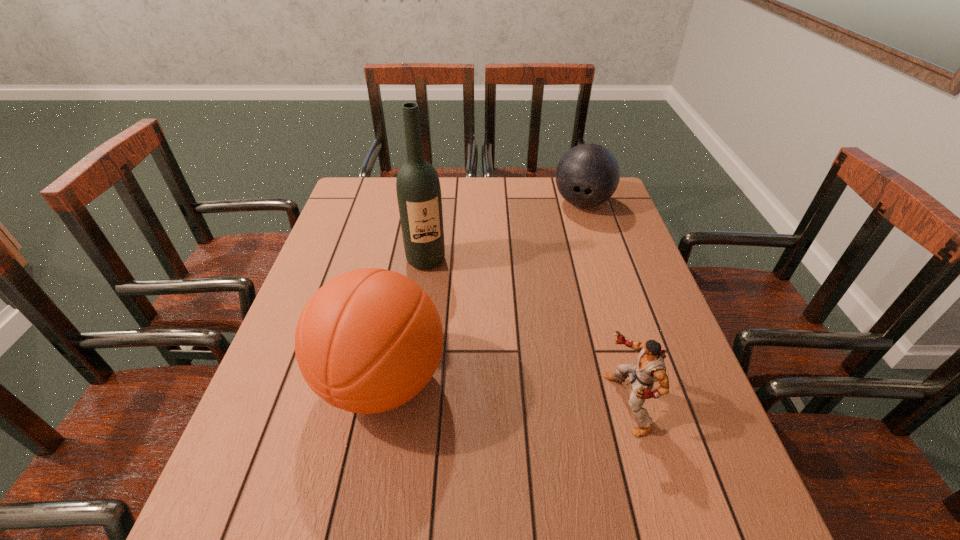
This screenshot has width=960, height=540. Identify the location of basketball. (369, 340).

I want to click on puncher, so click(650, 368).

Find the location of a particular element. This screenshot has height=540, width=960. the farthest object is located at coordinates (587, 175).

Identify the location of the second farthest object. (418, 189).

Identify the location of the tallest object. (418, 189).

Find the location of a particular element. The width and height of the screenshot is (960, 540). blank area located 0.220m on the right of the second tallest object is located at coordinates (549, 381).

Where is `vacant space located 0.200m on the front-facing side of the puncher`? vacant space located 0.200m on the front-facing side of the puncher is located at coordinates (508, 403).

Find the location of `vacant space located on the front-facing side of the puncher`. vacant space located on the front-facing side of the puncher is located at coordinates (557, 403).

Identify the location of free space located 0.070m on the front-facing side of the puncher. (571, 403).

At what (x,y) coordinates should I click in order to perform the action: click on vacant area situated 0.170m on the grip area of the farthest object. Please return your answer as a coordinate pair (x, y). The height and width of the screenshot is (540, 960). Looking at the image, I should click on (568, 251).